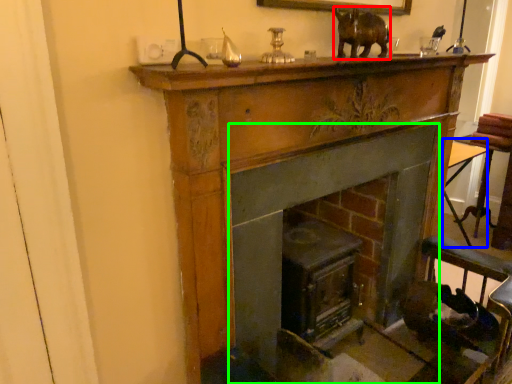
Question: Estimate the real-world distances between objects in this image. Which object is closer to animal (highlighted by a red box), table (highlighted by a blue box) or fireplace (highlighted by a green box)?

Choices:
 (A) table
 (B) fireplace

Answer: (B)